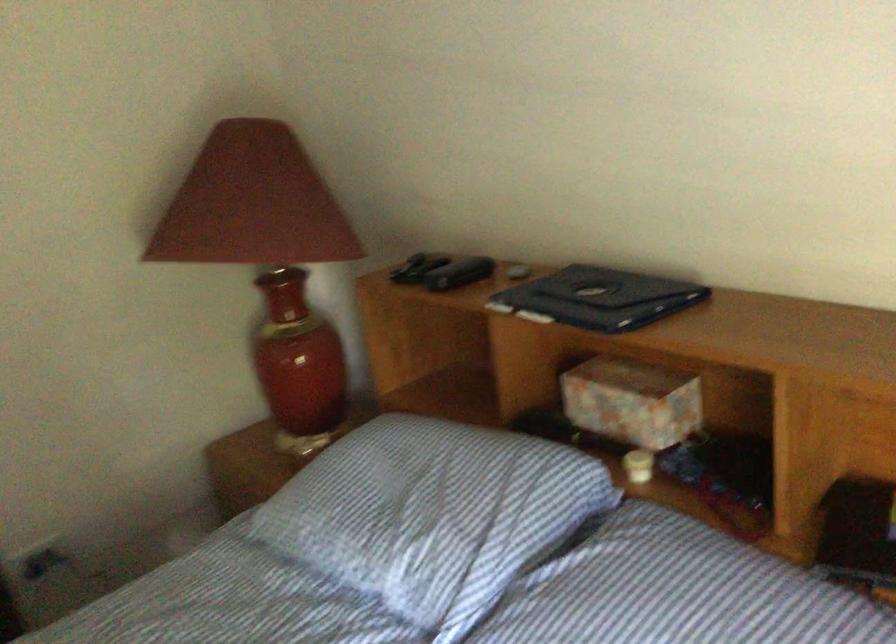
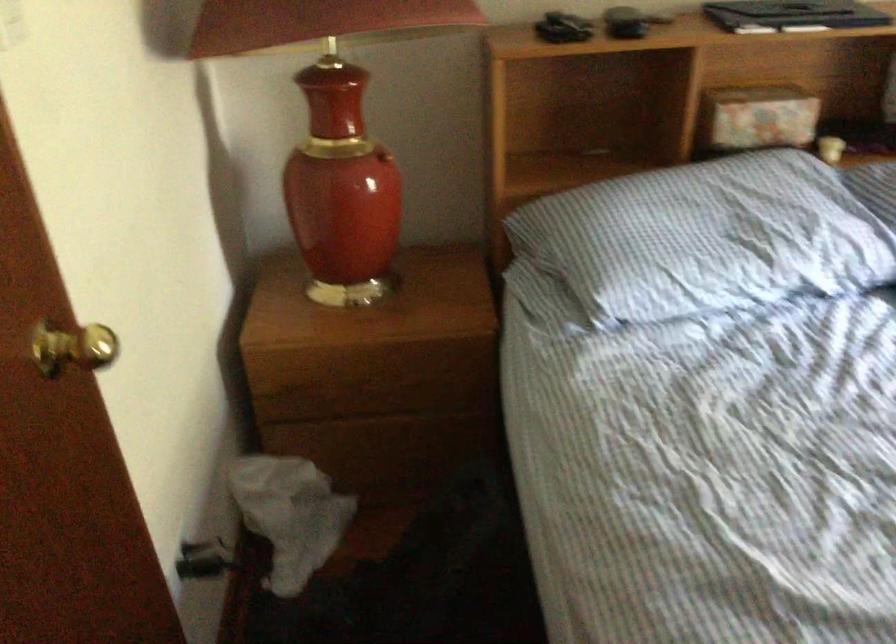
Locate, in the second image, the point that corresponds to point (95, 547) in the first image.

(204, 560)